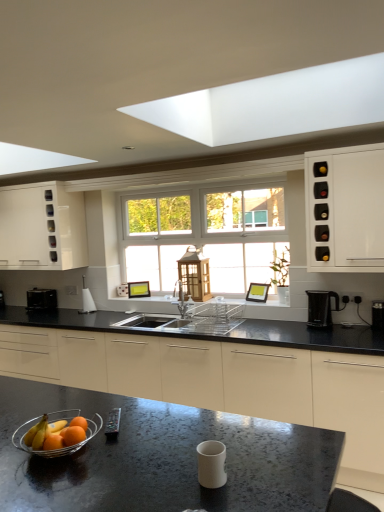
Identify the location of free spot to the right of clear glass bowl at lower left. The image size is (384, 512). (138, 451).